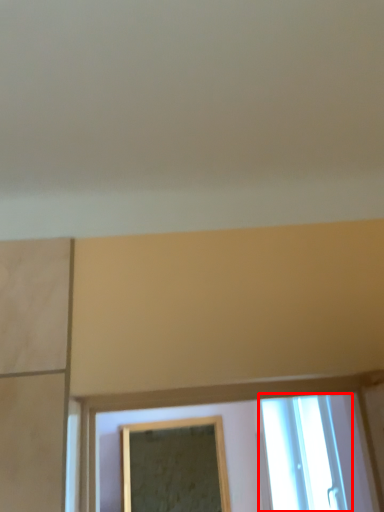
Question: From the image's perspective, where is window (annotated by the red box) located in relation to mirror in the image?

Choices:
 (A) above
 (B) below

Answer: (A)